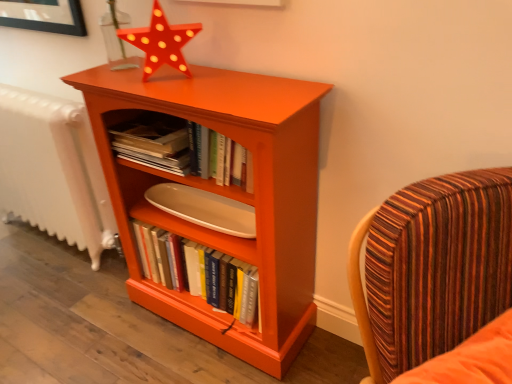
Question: Is white textured radiator at left oriented towards striped fabric chair at right?

Choices:
 (A) no
 (B) yes

Answer: (A)

Question: Can you confirm if white textured radiator at left is positioned to the right of striped fabric chair at right?

Choices:
 (A) no
 (B) yes

Answer: (A)

Question: Is white textured radiator at left at the left side of striped fabric chair at right?

Choices:
 (A) yes
 (B) no

Answer: (A)

Question: Considering the relative sizes of white textured radiator at left and striped fabric chair at right in the image provided, is white textured radiator at left taller than striped fabric chair at right?

Choices:
 (A) yes
 (B) no

Answer: (B)

Question: Can striped fabric chair at right be found inside white textured radiator at left?

Choices:
 (A) no
 (B) yes

Answer: (A)

Question: From the image's perspective, does white textured radiator at left appear higher than striped fabric chair at right?

Choices:
 (A) yes
 (B) no

Answer: (A)

Question: Does striped fabric chair at right lie behind white textured radiator at left?

Choices:
 (A) no
 (B) yes

Answer: (A)

Question: Is striped fabric chair at right outside white textured radiator at left?

Choices:
 (A) yes
 (B) no

Answer: (A)

Question: Considering the relative sizes of striped fabric chair at right and white textured radiator at left in the image provided, is striped fabric chair at right taller than white textured radiator at left?

Choices:
 (A) yes
 (B) no

Answer: (A)

Question: Is striped fabric chair at right to the left of white textured radiator at left from the viewer's perspective?

Choices:
 (A) no
 (B) yes

Answer: (A)

Question: Are striped fabric chair at right and white textured radiator at left beside each other?

Choices:
 (A) yes
 (B) no

Answer: (B)

Question: Can you confirm if striped fabric chair at right is smaller than white textured radiator at left?

Choices:
 (A) no
 (B) yes

Answer: (A)

Question: From a real-world perspective, is matte orange shelf at center beneath orange matte wood bookcase at center?

Choices:
 (A) no
 (B) yes

Answer: (A)